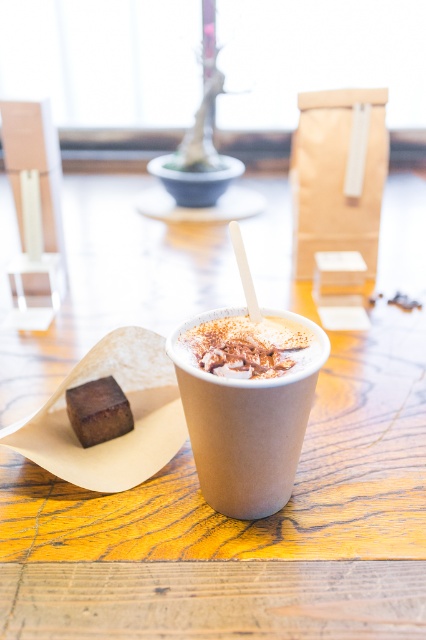
You are sitting at the wooden table in the image and want to reach for both objects labeled as point (322, 371) and point (227, 406). Which point do you need to reach over first to grab the one that is closer to you?

Point (227, 406) is closer to you than point (322, 371), so you should reach for point (227, 406) first.

You are a barista trying to place a new drink on the wooden table at center next to the brown paper cup at center. Can the table accommodate the drink without it hanging over the edge?

The wooden table at center is wider than the brown paper cup at center, so yes, the table can accommodate the new drink without it hanging over the edge since the table has more width available.